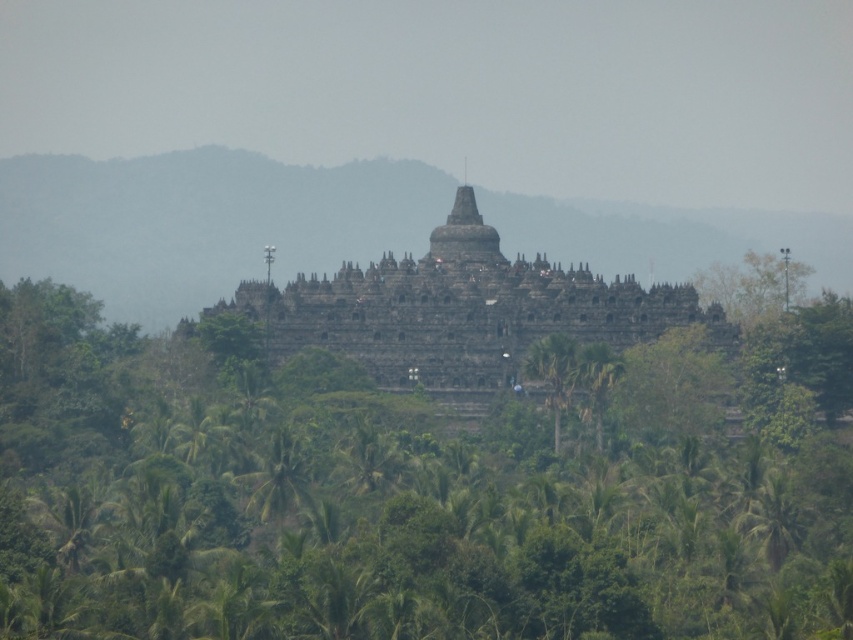
Which is in front, point (474, 440) or point (293, 324)?

Point (474, 440) is more forward.

Is green leafy tree at center closer to the viewer compared to dark stone hindu temple at center?

That is True.

Who is more distant from viewer, (245, 579) or (293, 307)?

The point (293, 307) is more distant.

Locate an element on the screen. Image resolution: width=853 pixels, height=640 pixels. green leafy tree at center is located at coordinates (415, 488).

Who is more distant from viewer, (529, 493) or (280, 458)?

Positioned behind is point (280, 458).

The width and height of the screenshot is (853, 640). Identify the location of green leafy tree at center. (415, 488).

Locate an element on the screen. This screenshot has width=853, height=640. green leafy tree at center is located at coordinates (415, 488).

Locate an element on the screen. This screenshot has height=640, width=853. dark stone hindu temple at center is located at coordinates (461, 308).

Is dark stone hindu temple at center thinner than green leafy palm tree at lower center?

No.

Who is more forward, (560, 275) or (286, 513)?

Point (286, 513) is in front.

Where is `dark stone hindu temple at center`? Image resolution: width=853 pixels, height=640 pixels. dark stone hindu temple at center is located at coordinates (461, 308).